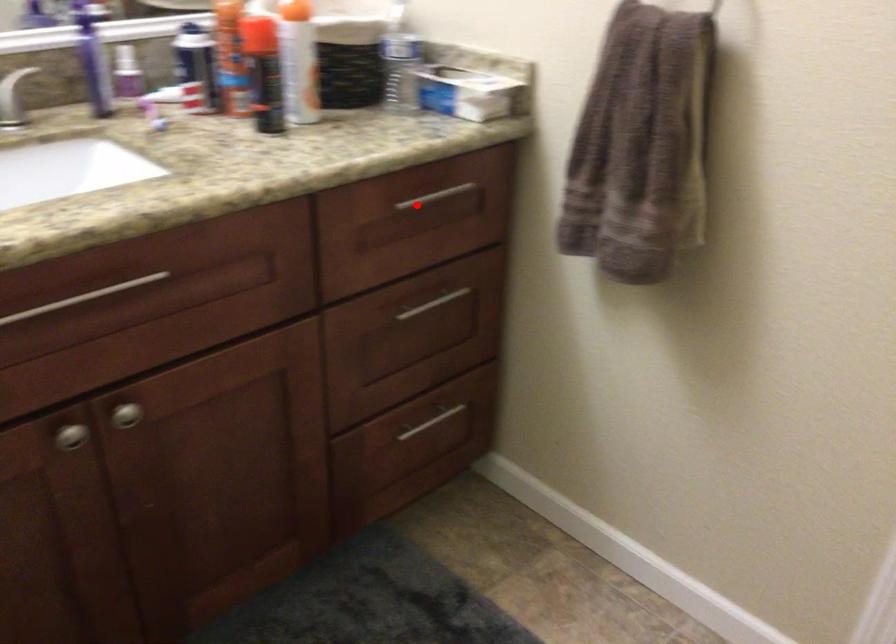
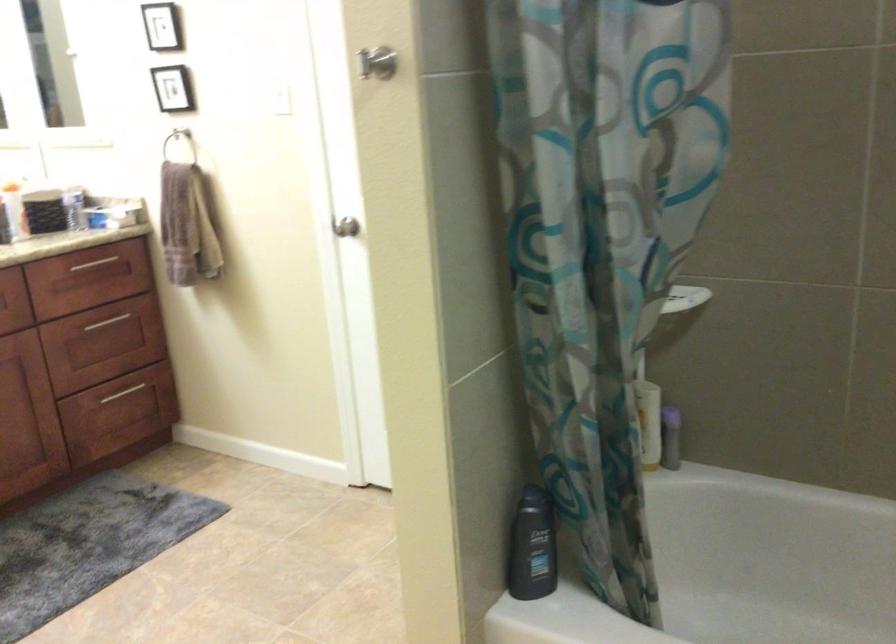
Question: I am providing you with two images of the same scene from different viewpoints. Image1 has a red point marked. In image2, the corresponding 3D location appears at what relative position? Reply with the corresponding letter.

Choices:
 (A) Closer
 (B) Farther

Answer: (B)